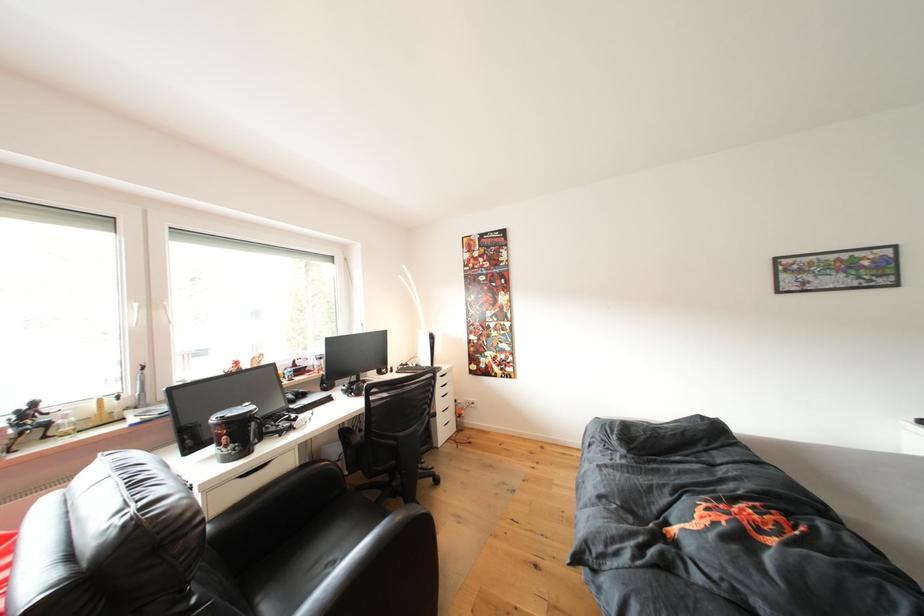
Describe the element at coordinates (313, 549) in the screenshot. This screenshot has height=616, width=924. I see `the black chair sitting surface` at that location.